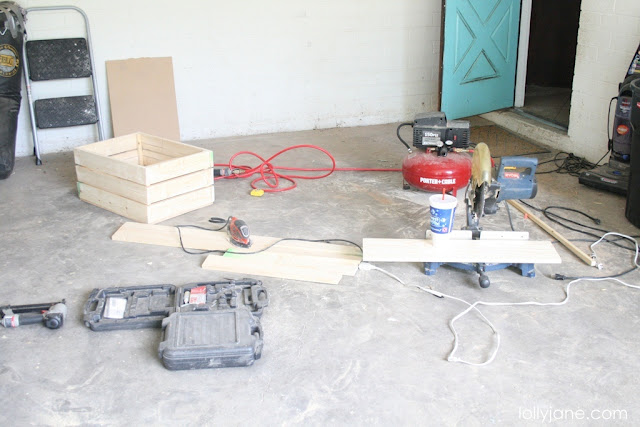
Locate an element on the screen. The image size is (640, 427). wooden crate is located at coordinates (188, 193).